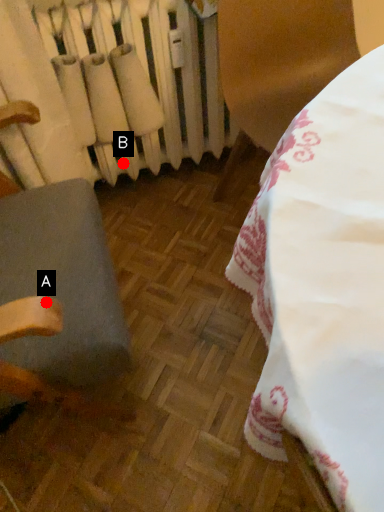
Question: Two points are circled on the image, labeled by A and B beside each circle. Which point is farther to the camera?

Choices:
 (A) A is further
 (B) B is further

Answer: (B)